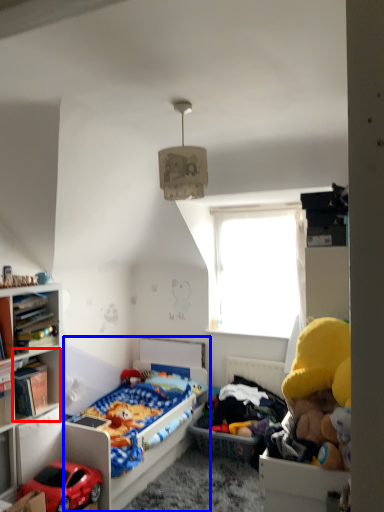
Question: Which object appears closest to the camera in this image, cabinet (highlighted by a red box) or bed (highlighted by a blue box)?

Choices:
 (A) cabinet
 (B) bed

Answer: (A)